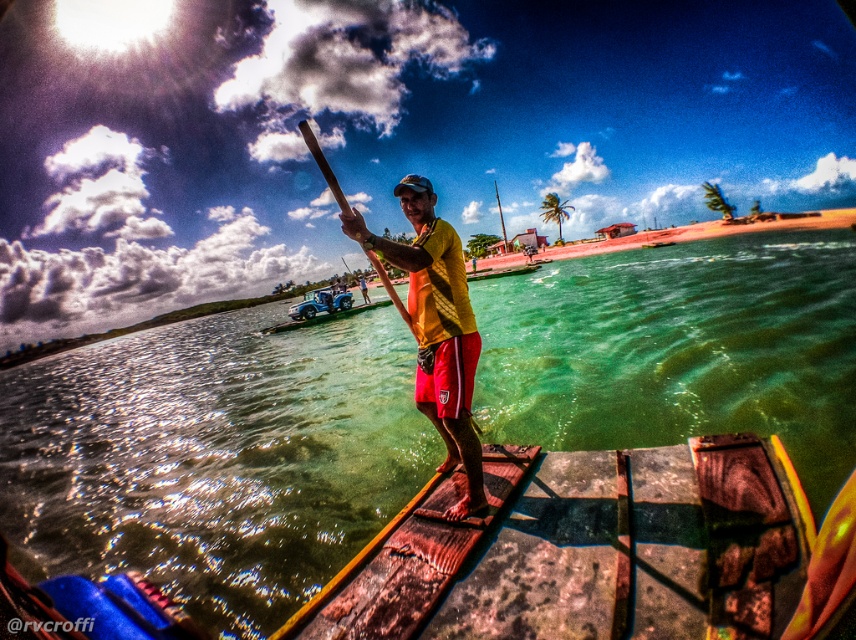
Question: Is green translucent water at center to the right of wooden planks at center from the viewer's perspective?

Choices:
 (A) no
 (B) yes

Answer: (B)

Question: Based on their relative distances, which object is farther from the wooden planks at center?

Choices:
 (A) wooden paddle at center
 (B) green translucent water at center

Answer: (B)

Question: Which of the following is the farthest from the observer?

Choices:
 (A) (642, 525)
 (B) (230, 424)
 (C) (401, 196)

Answer: (B)

Question: Which point appears farthest from the camera in this image?

Choices:
 (A) (336, 196)
 (B) (591, 474)
 (C) (366, 243)

Answer: (B)

Question: Can you confirm if wooden planks at center is positioned above yellow matte shirt at center?

Choices:
 (A) yes
 (B) no

Answer: (B)

Question: From the image, what is the correct spatial relationship of green translucent water at center in relation to yellow matte shirt at center?

Choices:
 (A) right
 (B) left

Answer: (A)